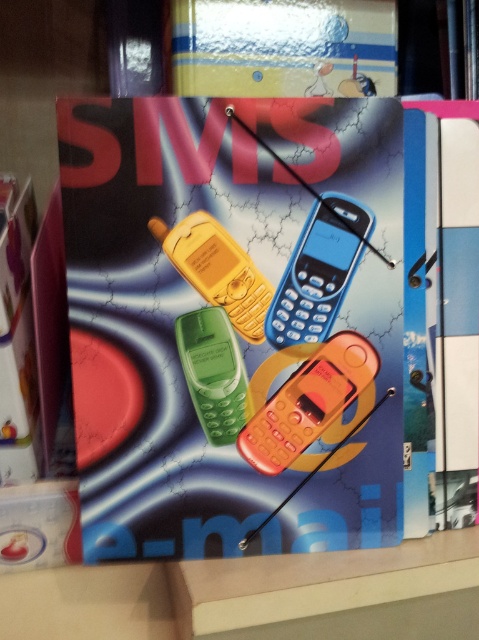
Question: Is matte plastic folder at center positioned in front of metallic yellow box at upper center?

Choices:
 (A) no
 (B) yes

Answer: (B)

Question: Is matte plastic folder at center below orange matte phone at center?

Choices:
 (A) no
 (B) yes

Answer: (A)

Question: Is matte plastic folder at center bigger than orange matte phone at center?

Choices:
 (A) no
 (B) yes

Answer: (B)

Question: Considering the real-world distances, which object is farthest from the matte plastic folder at center?

Choices:
 (A) metallic yellow box at upper center
 (B) orange matte phone at center
 (C) white glossy box at lower left
 (D) yellow matte phone at center

Answer: (C)

Question: Which object appears closest to the camera in this image?

Choices:
 (A) white glossy box at lower left
 (B) blue plastic phone at center
 (C) orange matte phone at center
 (D) yellow matte phone at center

Answer: (D)

Question: Among these objects, which one is farthest from the camera?

Choices:
 (A) matte plastic folder at center
 (B) green matte phone at center
 (C) metallic yellow box at upper center
 (D) blue plastic phone at center

Answer: (C)